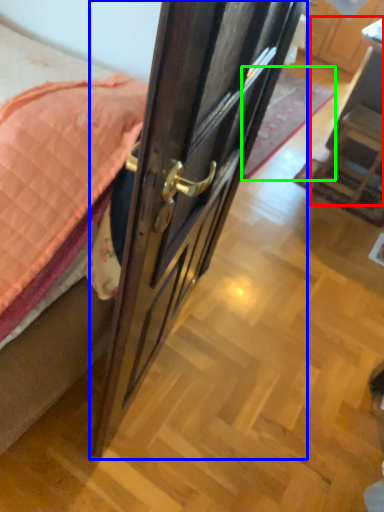
Question: Which object is the closest to the furniture (highlighted by a red box)? Choose among these: door (highlighted by a blue box) or plain (highlighted by a green box).

Choices:
 (A) door
 (B) plain

Answer: (B)